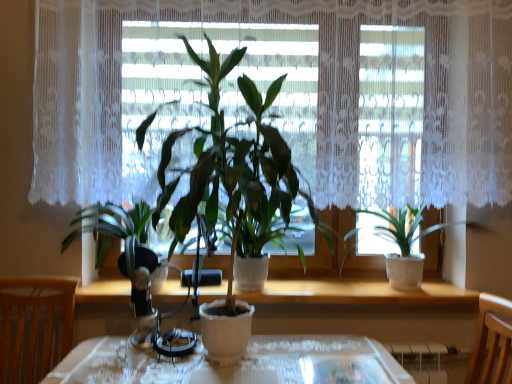
Question: Is green matte plant at center, placed as the 2th houseplant when sorted from right to left, not close to white lace curtain at center?

Choices:
 (A) yes
 (B) no

Answer: (B)

Question: Is green matte plant at center, which is the 2th houseplant from left to right, positioned in front of white lace curtain at center?

Choices:
 (A) no
 (B) yes

Answer: (B)

Question: Considering the relative sizes of green matte plant at center, placed as the 2th houseplant when sorted from right to left, and white lace curtain at center in the image provided, is green matte plant at center, placed as the 2th houseplant when sorted from right to left, taller than white lace curtain at center?

Choices:
 (A) yes
 (B) no

Answer: (A)

Question: Is green matte plant at center, which is the 2th houseplant from left to right, smaller than white lace curtain at center?

Choices:
 (A) yes
 (B) no

Answer: (B)

Question: Is the position of green matte plant at center, placed as the 2th houseplant when sorted from right to left, more distant than that of white lace curtain at center?

Choices:
 (A) no
 (B) yes

Answer: (A)

Question: Is green matte plant at right, placed as the third houseplant when sorted from left to right, in front of or behind white lace curtain at center in the image?

Choices:
 (A) behind
 (B) front

Answer: (A)

Question: From the image's perspective, is green matte plant at right, placed as the third houseplant when sorted from left to right, above or below white lace curtain at center?

Choices:
 (A) above
 (B) below

Answer: (B)

Question: From a real-world perspective, is green matte plant at right, positioned as the first houseplant in right-to-left order, physically located above or below white lace curtain at center?

Choices:
 (A) above
 (B) below

Answer: (B)

Question: Is point (404, 274) closer or farther from the camera than point (72, 140)?

Choices:
 (A) farther
 (B) closer

Answer: (A)

Question: Is green matte plant at right, positioned as the first houseplant in right-to-left order, bigger or smaller than green matte plant at left, which ranks as the first houseplant in left-to-right order?

Choices:
 (A) small
 (B) big

Answer: (A)

Question: Considering the positions of green matte plant at right, positioned as the first houseplant in right-to-left order, and green matte plant at left, which is the third houseplant from right to left, in the image, is green matte plant at right, positioned as the first houseplant in right-to-left order, wider or thinner than green matte plant at left, which is the third houseplant from right to left,?

Choices:
 (A) wide
 (B) thin

Answer: (B)

Question: Is green matte plant at right, placed as the third houseplant when sorted from left to right, spatially inside green matte plant at left, which is the third houseplant from right to left, or outside of it?

Choices:
 (A) inside
 (B) outside

Answer: (B)

Question: Would you say green matte plant at right, placed as the third houseplant when sorted from left to right, is to the left or to the right of green matte plant at left, which ranks as the first houseplant in left-to-right order, in the picture?

Choices:
 (A) right
 (B) left

Answer: (A)

Question: Which is correct: green matte plant at right, positioned as the first houseplant in right-to-left order, is inside green matte plant at center, placed as the 2th houseplant when sorted from right to left, or outside of it?

Choices:
 (A) inside
 (B) outside

Answer: (B)

Question: Based on their sizes in the image, would you say green matte plant at right, positioned as the first houseplant in right-to-left order, is bigger or smaller than green matte plant at center, placed as the 2th houseplant when sorted from right to left?

Choices:
 (A) small
 (B) big

Answer: (A)